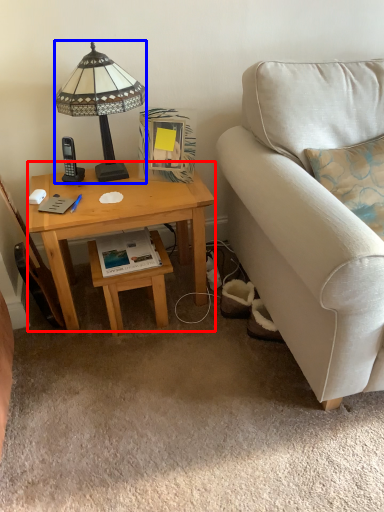
Question: Which object is further to the camera taking this photo, desk (highlighted by a red box) or lamp (highlighted by a blue box)?

Choices:
 (A) desk
 (B) lamp

Answer: (A)